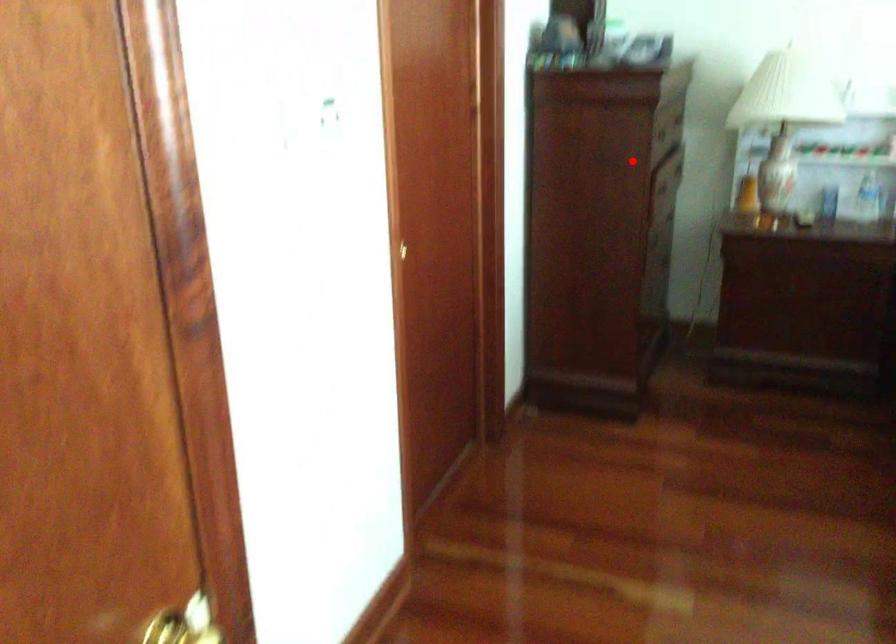
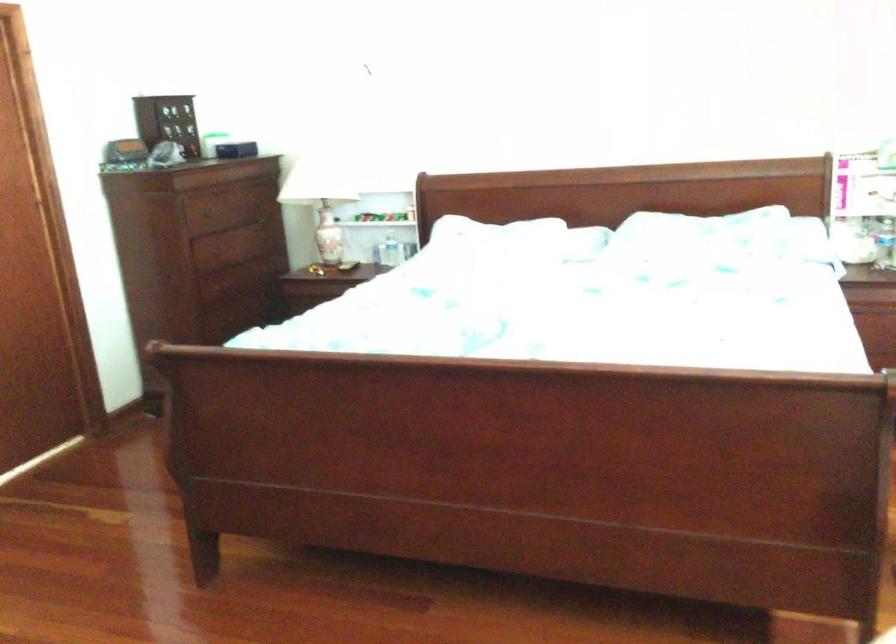
Question: I am providing you with two images of the same scene from different viewpoints. Image1 has a red point marked. In image2, the corresponding 3D location appears at what relative position? Reply with the corresponding letter.

Choices:
 (A) Closer
 (B) Farther

Answer: (B)